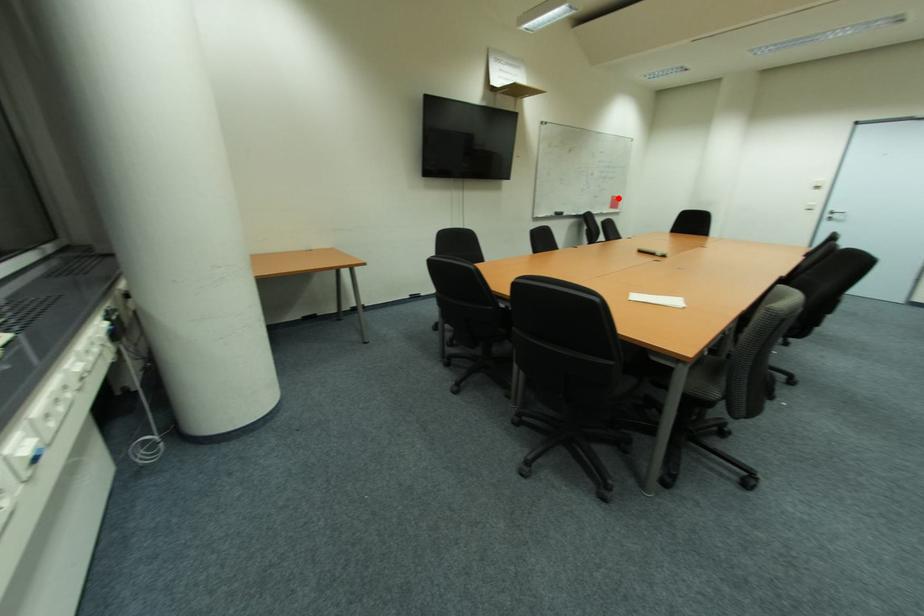
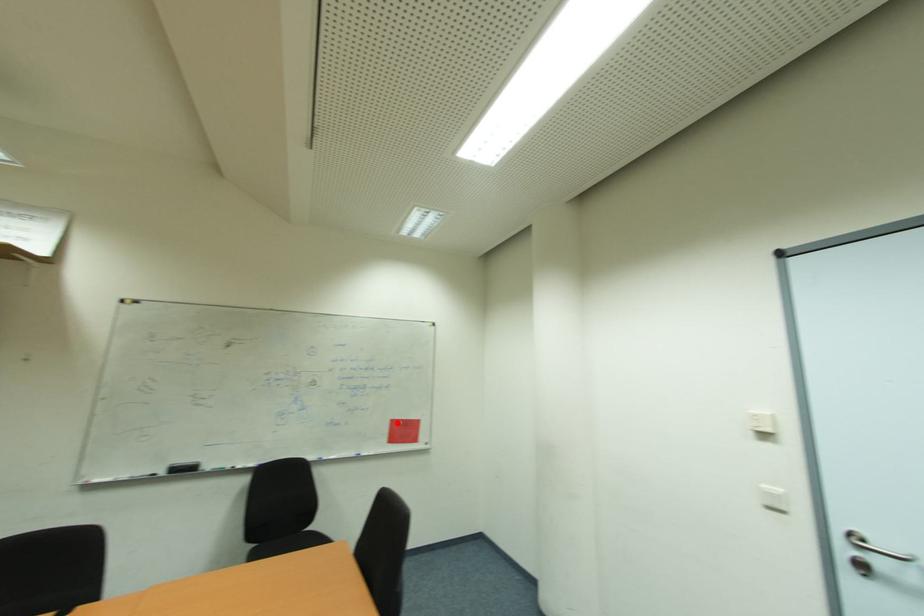
I am providing you with two images of the same scene from different viewpoints. A red point is marked on the first image and another point is marked on the second image. Do the highlighted points in image1 and image2 indicate the same real-world spot?

Yes